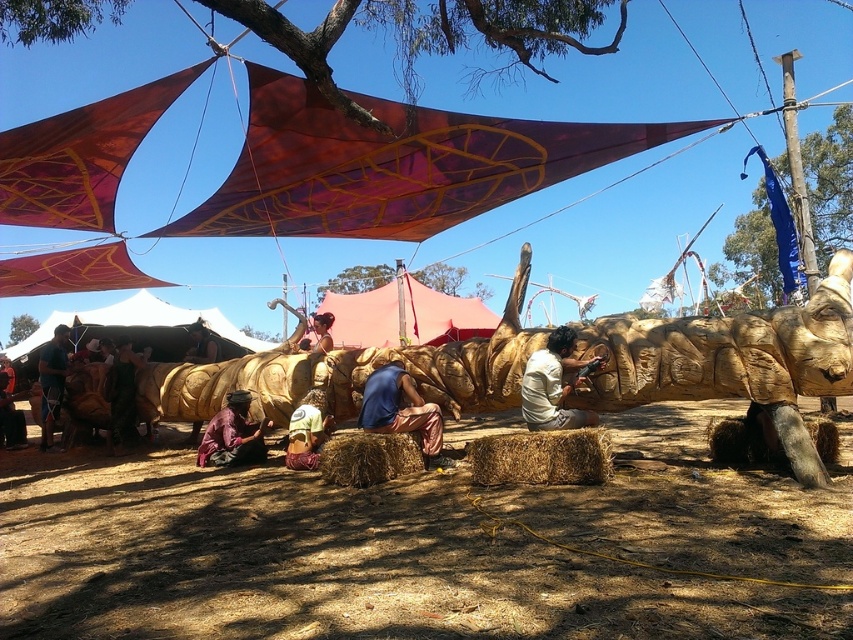
Question: Observing the image, what is the correct spatial positioning of smooth pink tent at center in reference to brown wood tree at center?

Choices:
 (A) below
 (B) above

Answer: (B)

Question: Where is brown straw bale at lower center located in relation to brown wood tree at center in the image?

Choices:
 (A) below
 (B) above

Answer: (A)

Question: Which object is farther from the camera taking this photo?

Choices:
 (A) brown wood tree at center
 (B) brown straw bale at lower center

Answer: (A)

Question: Which point appears farthest from the camera in this image?

Choices:
 (A) (10, 333)
 (B) (553, 52)
 (C) (39, 364)
 (D) (645, 618)

Answer: (A)

Question: Which point is farther to the camera?

Choices:
 (A) (364, 388)
 (B) (9, 339)

Answer: (B)

Question: Can you confirm if brown straw bale at lower right is positioned to the left of brown woven fabric at center?

Choices:
 (A) yes
 (B) no

Answer: (B)